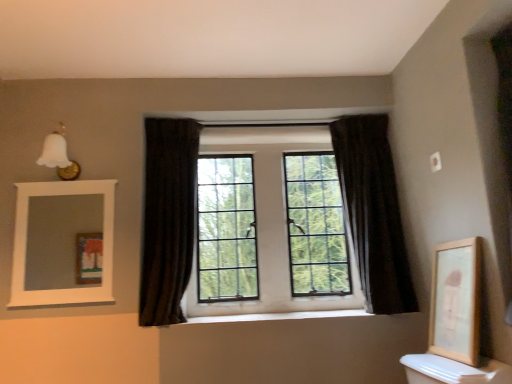
Question: Can you confirm if dark fabric curtain at center, arranged as the first curtain when viewed from the right, is shorter than wooden framed artwork at right?

Choices:
 (A) no
 (B) yes

Answer: (A)

Question: From the image's perspective, is dark fabric curtain at center, arranged as the first curtain when viewed from the right, located beneath wooden framed artwork at right?

Choices:
 (A) yes
 (B) no

Answer: (B)

Question: Is dark fabric curtain at center, arranged as the first curtain when viewed from the right, closer to the viewer compared to wooden framed artwork at right?

Choices:
 (A) no
 (B) yes

Answer: (A)

Question: Considering the relative positions of dark fabric curtain at center, arranged as the first curtain when viewed from the right, and wooden framed artwork at right in the image provided, is dark fabric curtain at center, arranged as the first curtain when viewed from the right, to the left of wooden framed artwork at right from the viewer's perspective?

Choices:
 (A) no
 (B) yes

Answer: (B)

Question: Is dark fabric curtain at center, arranged as the first curtain when viewed from the right, taller than wooden framed artwork at right?

Choices:
 (A) no
 (B) yes

Answer: (B)

Question: From a real-world perspective, is dark velvet curtain at center, acting as the first curtain starting from the left, positioned above or below white wooden mirror at upper left?

Choices:
 (A) below
 (B) above

Answer: (B)

Question: Is dark velvet curtain at center, positioned as the 2th curtain in right-to-left order, taller or shorter than white wooden mirror at upper left?

Choices:
 (A) tall
 (B) short

Answer: (A)

Question: From the image's perspective, is dark velvet curtain at center, positioned as the 2th curtain in right-to-left order, located above or below white wooden mirror at upper left?

Choices:
 (A) below
 (B) above

Answer: (B)

Question: Considering their positions, is dark velvet curtain at center, acting as the first curtain starting from the left, located in front of or behind white wooden mirror at upper left?

Choices:
 (A) front
 (B) behind

Answer: (A)

Question: Is point (321, 274) positioned closer to the camera than point (291, 312)?

Choices:
 (A) closer
 (B) farther

Answer: (B)

Question: From a real-world perspective, is clear glass windows at center positioned above or below white smooth window sill at center?

Choices:
 (A) below
 (B) above

Answer: (B)

Question: Is clear glass windows at center bigger or smaller than white smooth window sill at center?

Choices:
 (A) big
 (B) small

Answer: (A)

Question: Is clear glass windows at center situated inside white smooth window sill at center or outside?

Choices:
 (A) inside
 (B) outside

Answer: (B)

Question: Is white wooden mirror at upper left situated inside dark fabric curtain at center, the 2th curtain positioned from the left, or outside?

Choices:
 (A) inside
 (B) outside

Answer: (B)

Question: From the image's perspective, relative to dark fabric curtain at center, arranged as the first curtain when viewed from the right, is white wooden mirror at upper left above or below?

Choices:
 (A) above
 (B) below

Answer: (B)